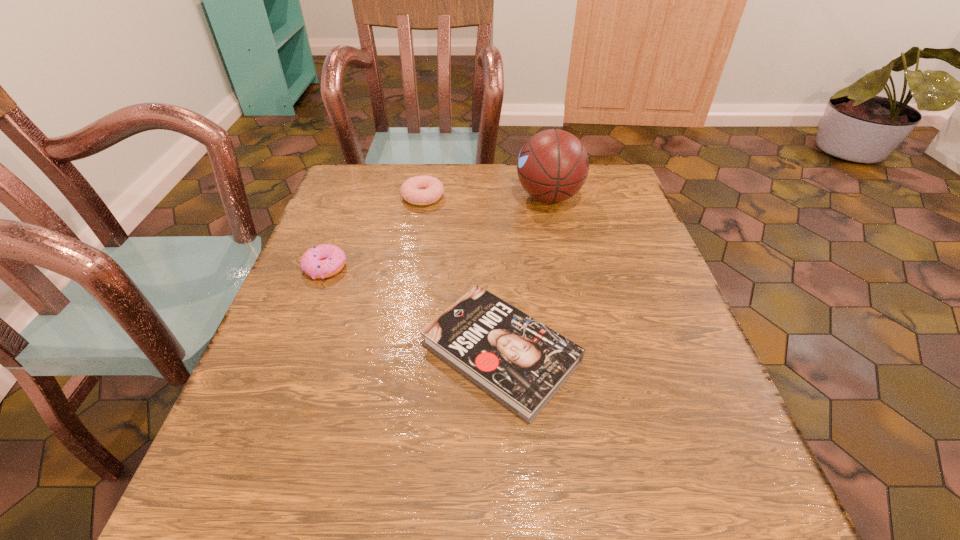
The width and height of the screenshot is (960, 540). Find the location of `basketball present at the far edge`. basketball present at the far edge is located at coordinates (x=553, y=165).

Image resolution: width=960 pixels, height=540 pixels. Find the location of `doughnut at the far edge`. doughnut at the far edge is located at coordinates (419, 190).

Locate an element on the screen. The height and width of the screenshot is (540, 960). object present at the left edge is located at coordinates (322, 261).

Image resolution: width=960 pixels, height=540 pixels. I want to click on object that is positioned at the right edge, so click(x=553, y=165).

Image resolution: width=960 pixels, height=540 pixels. Find the location of `object present at the far right corner`. object present at the far right corner is located at coordinates (553, 165).

The height and width of the screenshot is (540, 960). In order to click on free space at the far edge of the desktop in this screenshot , I will do `click(491, 210)`.

Locate an element on the screen. The image size is (960, 540). vacant space at the left edge of the desktop is located at coordinates (339, 234).

Identify the location of free space at the right edge. The height and width of the screenshot is (540, 960). (626, 222).

This screenshot has width=960, height=540. In the image, there is a desktop. What are the coordinates of `free space at the far left corner` in the screenshot? It's located at (399, 175).

In the image, there is a desktop. Identify the location of free region at the near left corner. (249, 524).